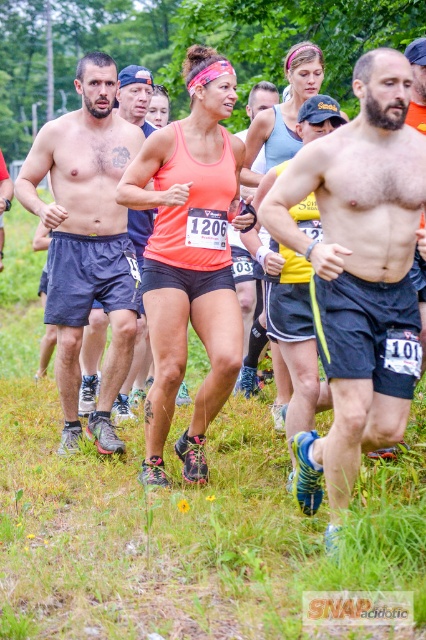
Who is shorter, neon orange tank top at center or matte blue shorts at left?

Standing shorter between the two is neon orange tank top at center.

Does neon orange tank top at center have a lesser height compared to matte blue shorts at left?

Yes, neon orange tank top at center is shorter than matte blue shorts at left.

Who is more distant from viewer, (187, 476) or (69, 387)?

Point (69, 387)

Locate an element on the screen. The width and height of the screenshot is (426, 640). neon orange tank top at center is located at coordinates (189, 257).

Can you confirm if shiny blue shorts at center is positioned to the right of matte blue shorts at left?

Yes, shiny blue shorts at center is to the right of matte blue shorts at left.

Is shiny blue shorts at center thinner than matte blue shorts at left?

No.

Between point (370, 204) and point (98, 100), which one is positioned in front?

Point (370, 204)

You are a GUI agent. You are given a task and a screenshot of the screen. Output one action in this format:
    pyautogui.click(x=<x>, y=<y>)
    Task: Click on the shiny blue shorts at center
    The image size is (426, 640).
    Given the screenshot: What is the action you would take?
    pyautogui.click(x=359, y=275)

Which is below, shiny blue shorts at center or neon orange tank top at center?

Positioned lower is shiny blue shorts at center.

Based on the photo, is shiny blue shorts at center shorter than neon orange tank top at center?

Yes, shiny blue shorts at center is shorter than neon orange tank top at center.

Describe the element at coordinates (359, 275) in the screenshot. I see `shiny blue shorts at center` at that location.

Image resolution: width=426 pixels, height=640 pixels. Find the location of `shiny blue shorts at center`. shiny blue shorts at center is located at coordinates (359, 275).